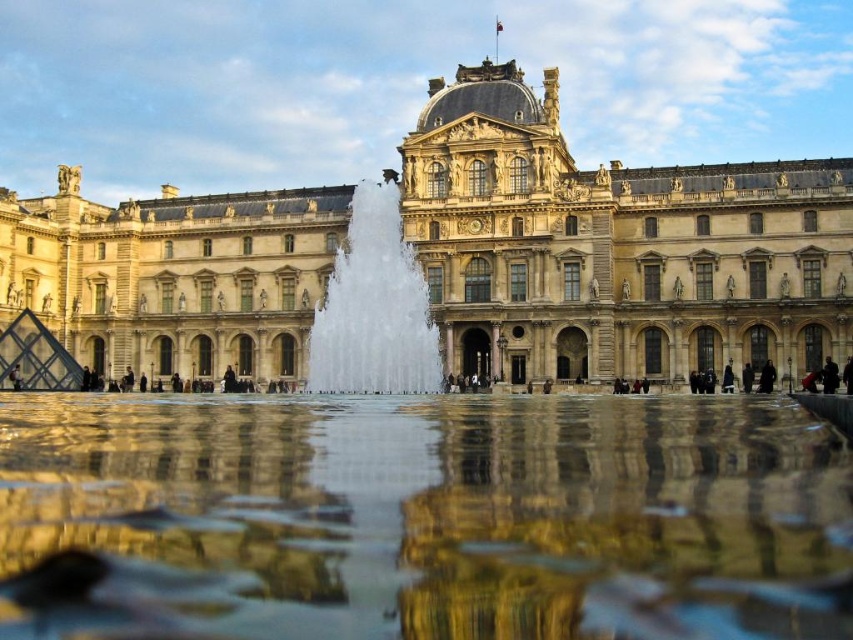
Which is above, clear glass water at center or beige stone palace at center?

beige stone palace at center is above.

Who is shorter, clear glass water at center or beige stone palace at center?

With less height is clear glass water at center.

Locate an element on the screen. This screenshot has height=640, width=853. clear glass water at center is located at coordinates (421, 516).

In order to click on clear glass water at center in this screenshot , I will do `click(421, 516)`.

Is point (218, 436) closer to camera compared to point (383, 227)?

Yes, it is.

Does point (245, 474) come in front of point (405, 289)?

Yes.

Locate an element on the screen. The width and height of the screenshot is (853, 640). clear glass water at center is located at coordinates (421, 516).

Which is behind, point (770, 326) or point (404, 308)?

Positioned behind is point (404, 308).

Between beige stone palace at center and clear water fountain at center, which one appears on the left side from the viewer's perspective?

Positioned to the left is beige stone palace at center.

Is point (787, 326) more distant than point (415, 371)?

No, it is in front of (415, 371).

You are a GUI agent. You are given a task and a screenshot of the screen. Output one action in this format:
    pyautogui.click(x=<x>, y=<y>)
    Task: Click on the beige stone palace at center
    The image size is (853, 640).
    Given the screenshot: What is the action you would take?
    pyautogui.click(x=614, y=246)